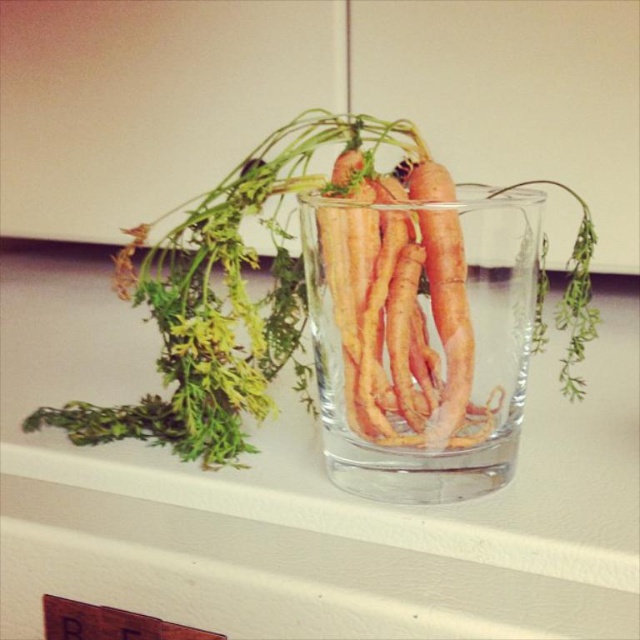
You are holding a ruler and want to measure the distance from your eyes to the point at coordinates point (x=387, y=420) in the image. What is the actual distance in inches?

The distance of point (x=387, y=420) from viewer is 6.86 inches.

Where is the clear glass at center located in the image?

The clear glass at center is located at point [301,496].